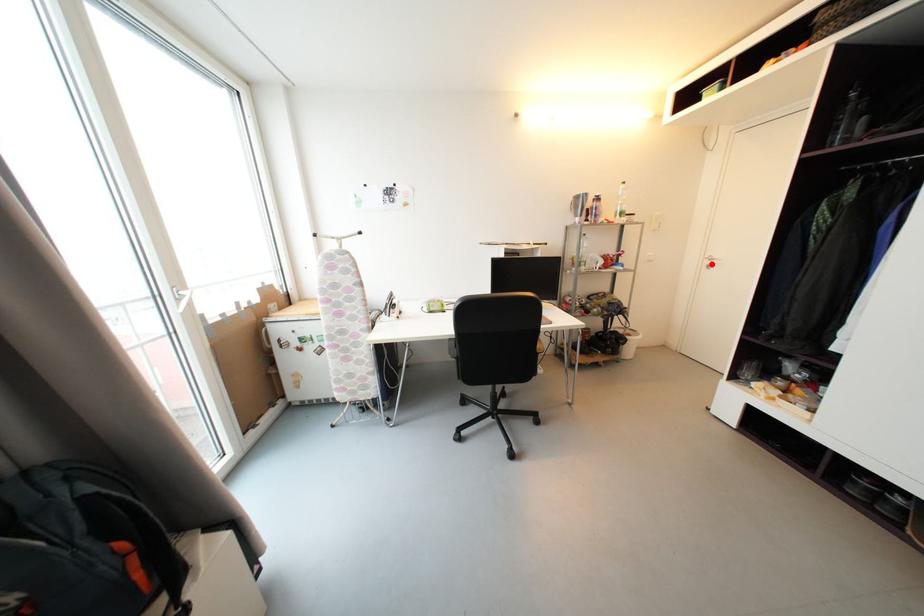
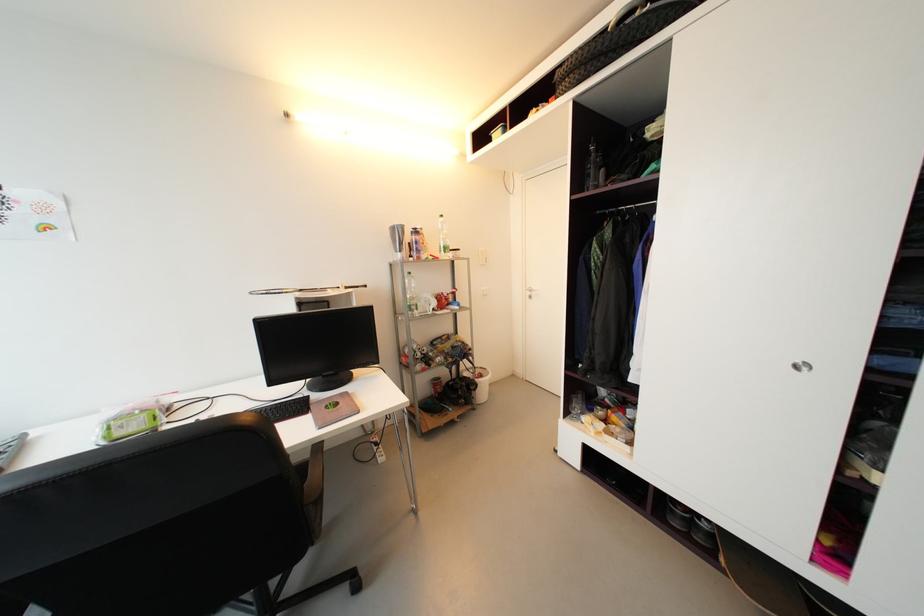
The point at the highlighted location is marked in the first image. Where is the corresponding point in the second image?

(533, 294)